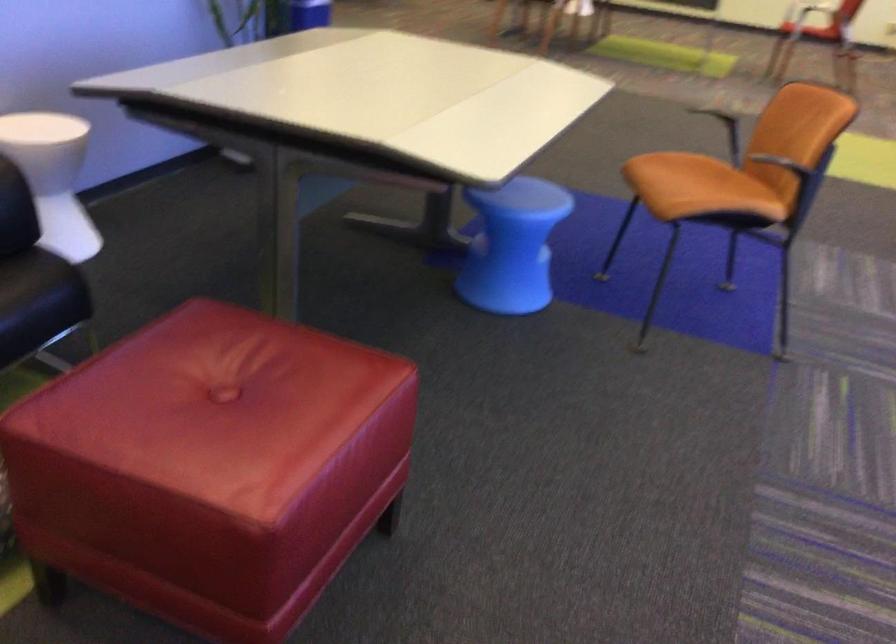
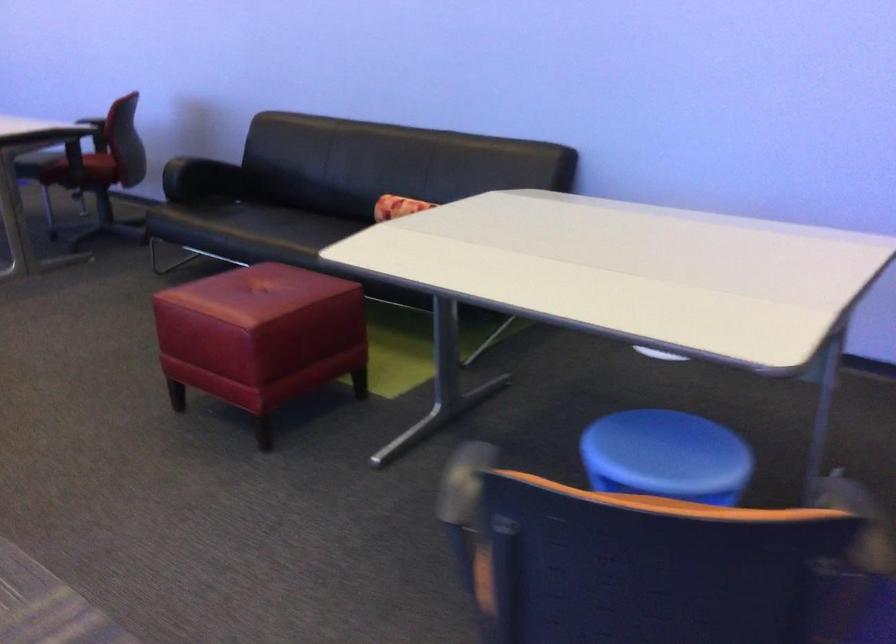
Find the pixel in the second image that matches point 394,375 in the first image.

(261, 337)